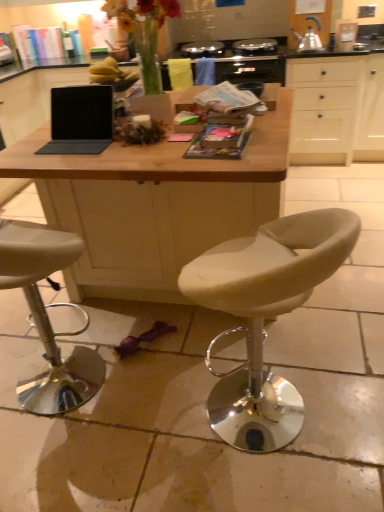
Where is `free space to the left of white leather stool at center, the 1th chair positioned from the right`? The width and height of the screenshot is (384, 512). free space to the left of white leather stool at center, the 1th chair positioned from the right is located at coordinates (149, 432).